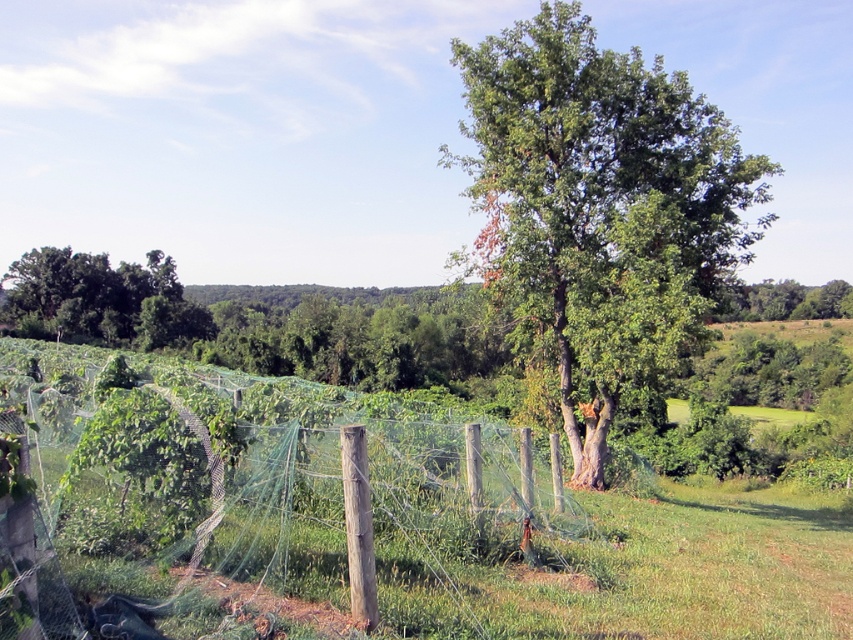
Can you confirm if green leafy tree at center is smaller than green leafy tree at left?

Yes, green leafy tree at center is smaller than green leafy tree at left.

Is green leafy tree at center shorter than green leafy tree at left?

Yes, green leafy tree at center is shorter than green leafy tree at left.

Image resolution: width=853 pixels, height=640 pixels. I want to click on green leafy tree at center, so (601, 208).

Locate an element on the screen. Image resolution: width=853 pixels, height=640 pixels. green leafy tree at center is located at coordinates (601, 208).

Is point (514, 440) more distant than point (592, 298)?

No.

Does green mesh net at center have a greater height compared to green leafy tree at center?

No.

Find the location of a particular element. green mesh net at center is located at coordinates (254, 506).

Between green mesh net at center and green leafy tree at left, which one appears on the right side from the viewer's perspective?

green mesh net at center

Is green mesh net at center above green leafy tree at left?

No.

Between point (245, 480) and point (114, 346), which one is positioned in front?

Positioned in front is point (245, 480).

Where is `green mesh net at center`? This screenshot has height=640, width=853. green mesh net at center is located at coordinates (254, 506).